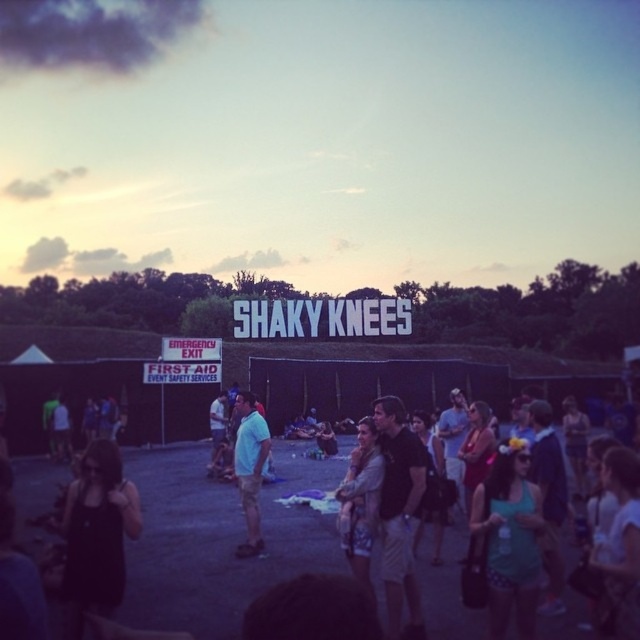
Which is behind, point (525, 561) or point (257, 538)?

Positioned behind is point (257, 538).

Is teal fabric dress at center taller than matte blue shirt at center?

Yes, teal fabric dress at center is taller than matte blue shirt at center.

Is point (515, 481) closer to camera compared to point (246, 531)?

Yes, point (515, 481) is in front of point (246, 531).

At what (x,y) coordinates should I click in order to perform the action: click on teal fabric dress at center. Please return your answer as a coordinate pair (x, y). Image resolution: width=640 pixels, height=640 pixels. Looking at the image, I should click on (509, 538).